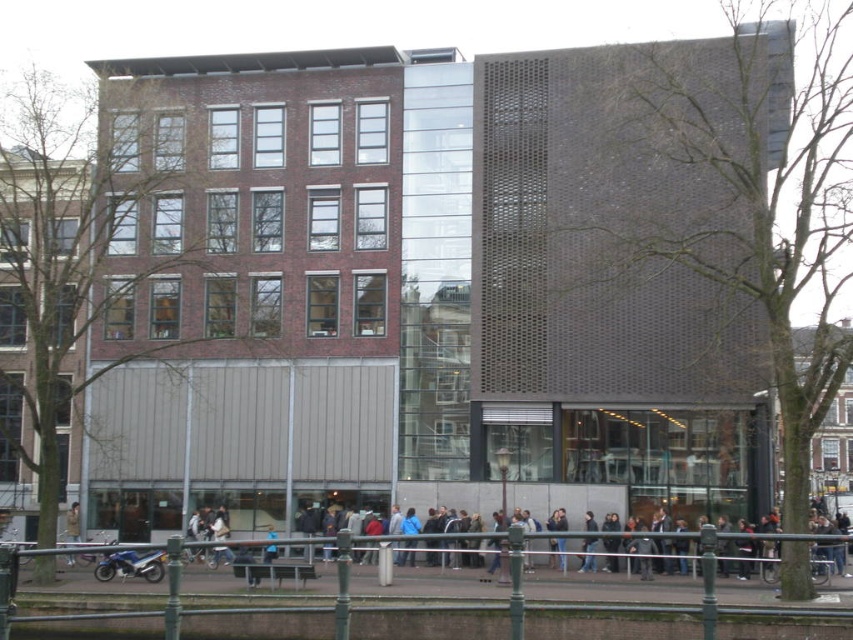
Question: Among these points, which one is nearest to the camera?

Choices:
 (A) (71, 508)
 (B) (160, 572)

Answer: (B)

Question: Is blue metallic motorcycle at lower left closer to camera compared to khaki fabric jacket at center?

Choices:
 (A) yes
 (B) no

Answer: (A)

Question: Can you confirm if blue metallic motorcycle at lower left is wider than khaki fabric jacket at center?

Choices:
 (A) yes
 (B) no

Answer: (B)

Question: Which of the following is the farthest from the observer?

Choices:
 (A) (76, 506)
 (B) (125, 557)

Answer: (A)

Question: Does blue metallic motorcycle at lower left appear over khaki fabric jacket at center?

Choices:
 (A) no
 (B) yes

Answer: (B)